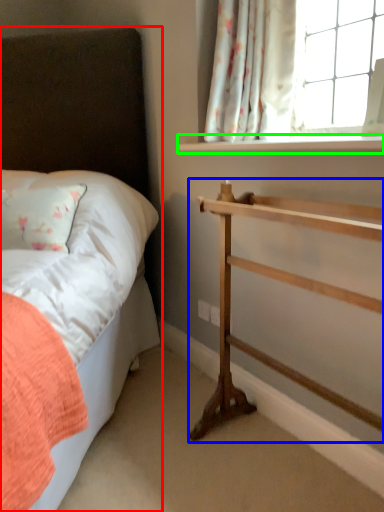
Question: Based on their relative distances, which object is nearer to bed (highlighted by a red box)? Choose from shelf (highlighted by a blue box) and window sill (highlighted by a green box).

Choices:
 (A) shelf
 (B) window sill

Answer: (B)